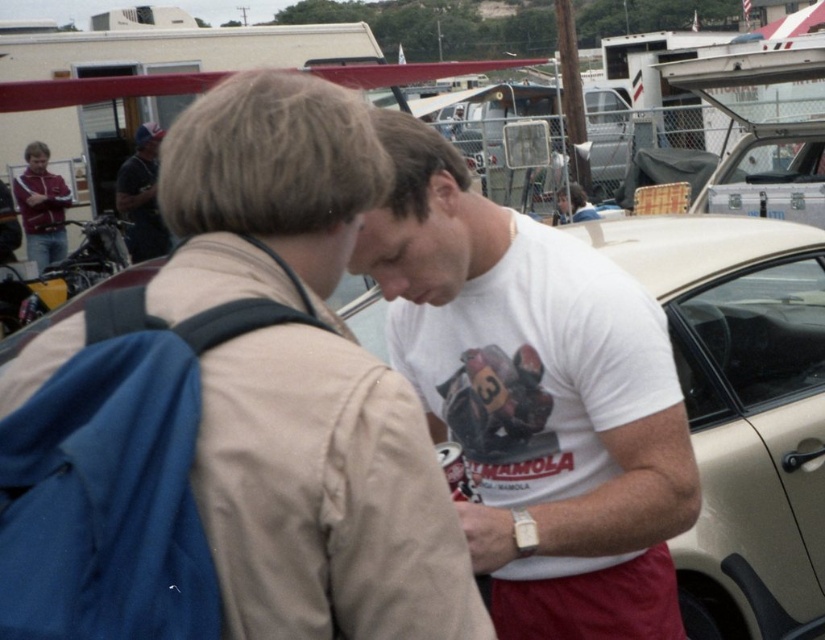
You are a photographer trying to capture the white cotton t shirt at center. You notice a point at coordinates (541, 392) in the image. Is this point located on the white cotton t shirt at center?

Yes, the point (541, 392) is located on the white cotton t shirt at center according to the description.